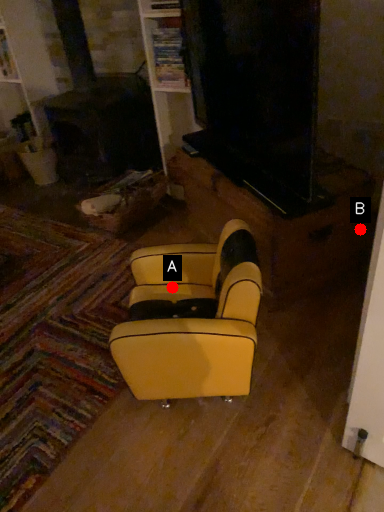
Question: Two points are circled on the image, labeled by A and B beside each circle. Which point appears closest to the camera in this image?

Choices:
 (A) A is closer
 (B) B is closer

Answer: (A)